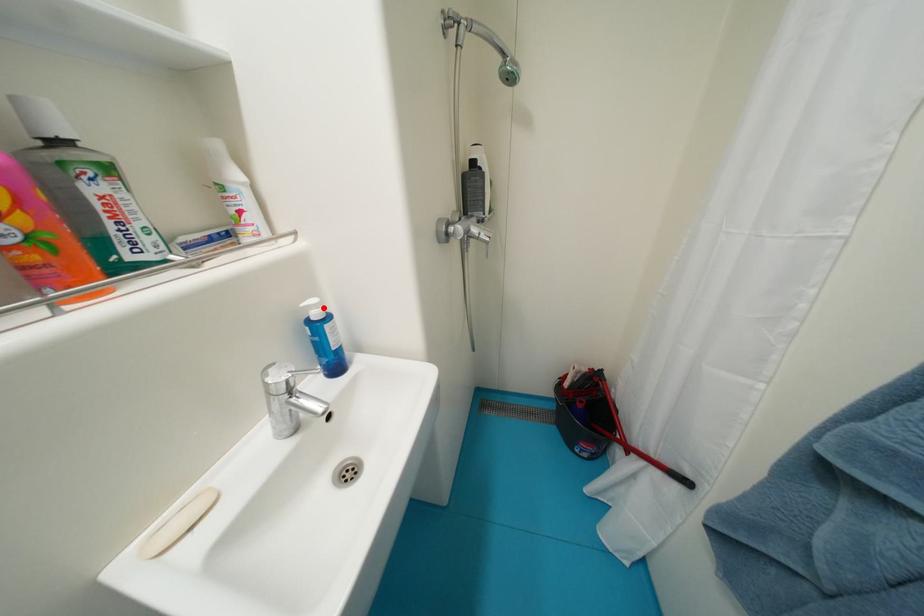
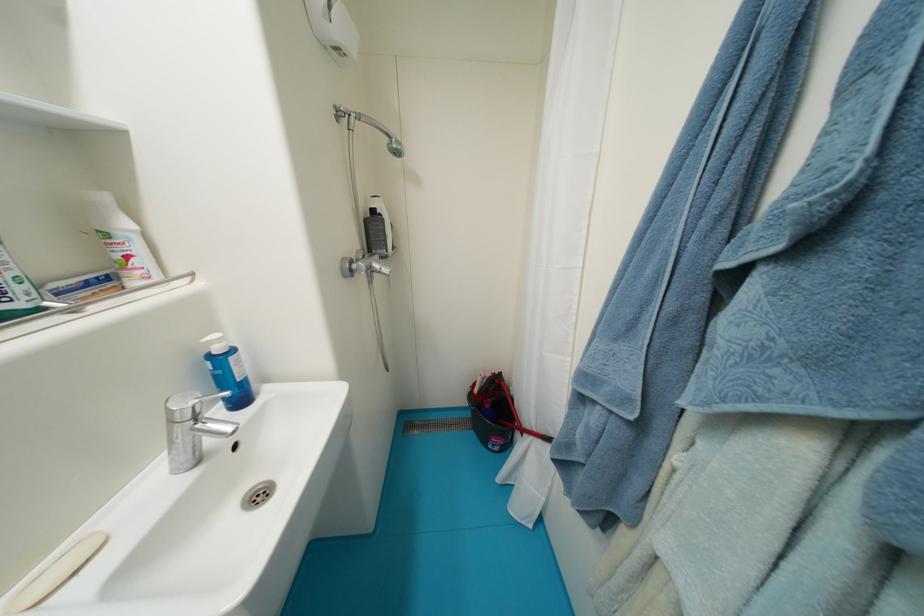
Find the pixel in the second image that matches the highlighted location in the first image.

(225, 342)